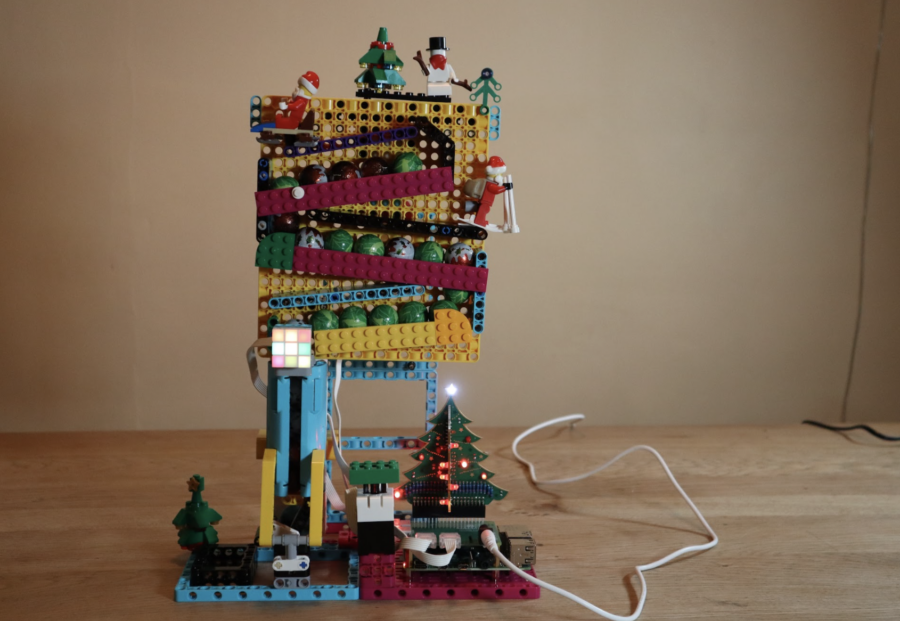
Locate an element on the screen. The image size is (900, 621). black cord is located at coordinates (835, 427).